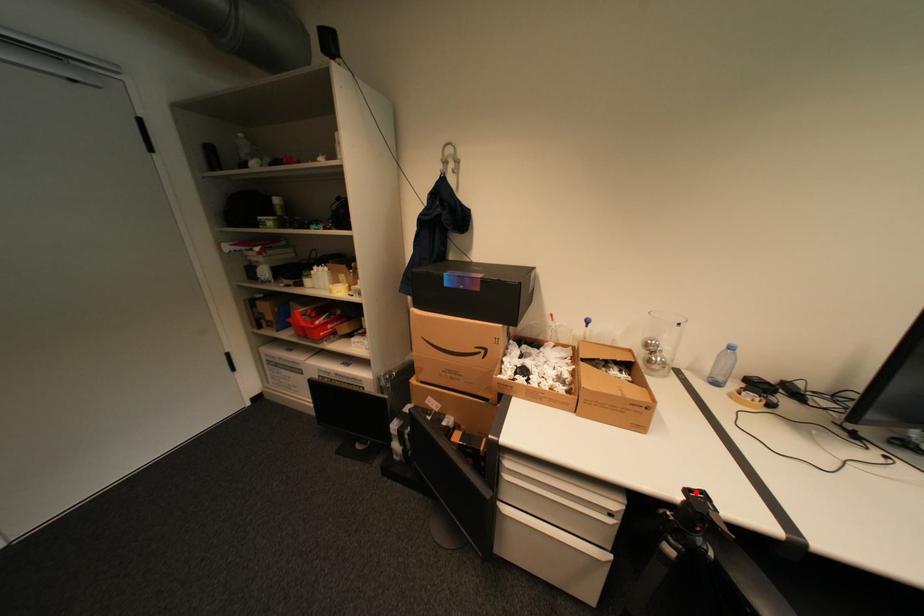
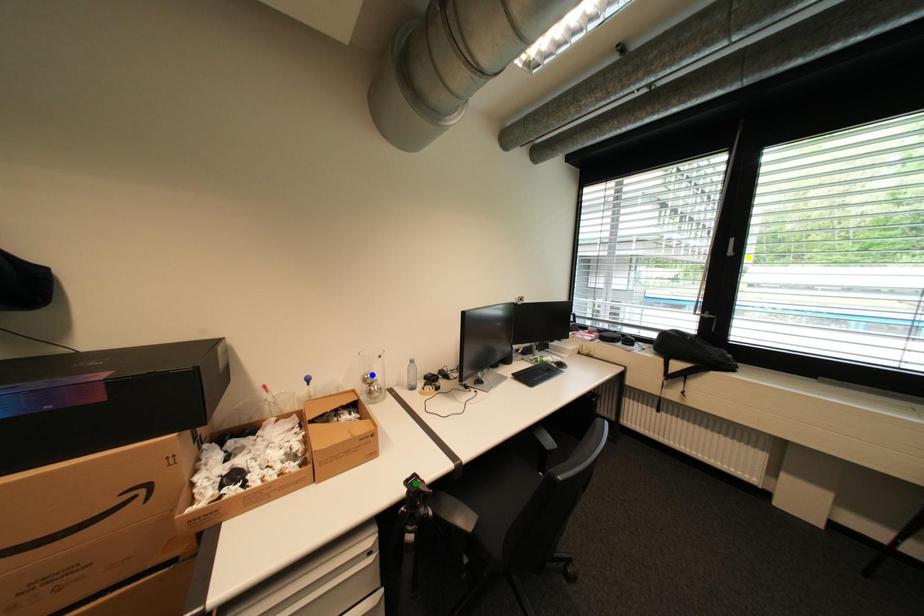
Question: I am providing you with two images of the same scene from different viewpoints. A red point is marked on the first image. You are given multiple points on the second image. Can you choose the point in image 2 that corresponds to the point in image 1?

Choices:
 (A) yellow point
 (B) blue point
 (C) green point

Answer: (C)